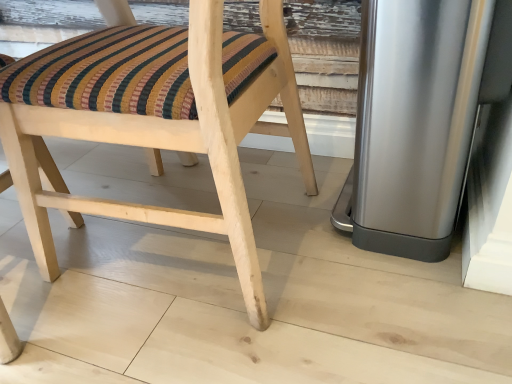
Find the location of a particular element. The image size is (512, 384). free area in between natural wood chair at center and polished stainless steel trash can at right is located at coordinates (316, 267).